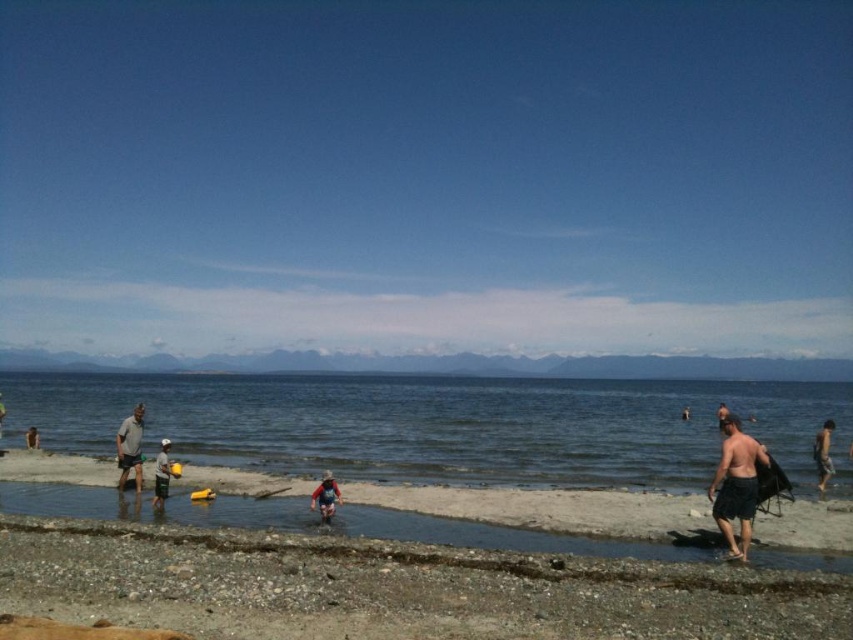
You are a beachgoer who wants to place your yellow plastic bucket at lower left on the smooth sand beach at center. Will the bucket be fully visible from above when placed there?

The smooth sand beach at center is not as tall as the yellow plastic bucket at lower left, so when placed there, the bucket will be taller than the beach surface, making it fully visible from above.

You are a photographer trying to capture a candid shot of the two people on the beach. You notice the shiny black shorts at right and the matte gray shorts at left. Which person should you focus on to get a better chance of capturing their full body in the frame, considering their height differences?

The matte gray shorts at left should be focused on because they are taller than the shiny black shorts at right, making it easier to frame their full body in the shot.